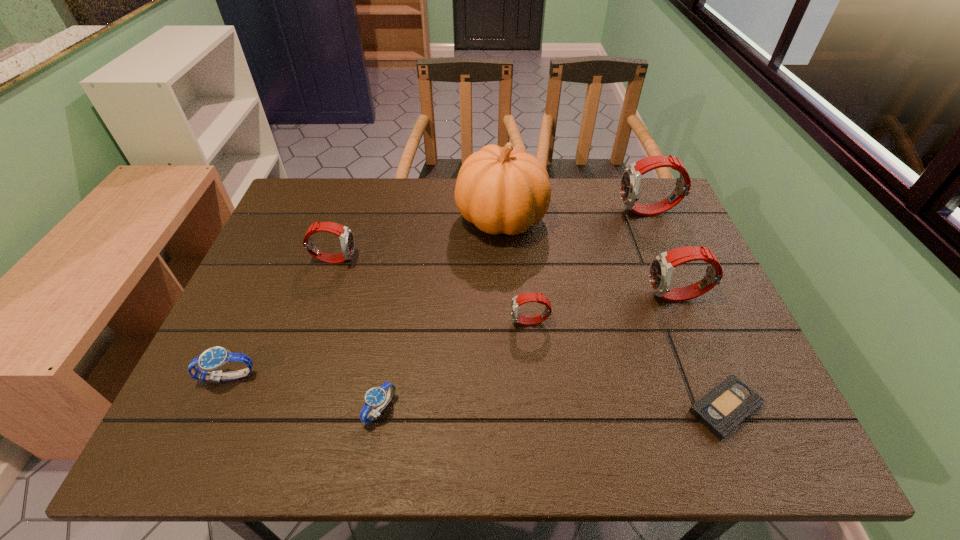
Locate an element on the screen. orange pumpkin is located at coordinates (501, 190).

Identify the location of pumpkin. (501, 190).

The width and height of the screenshot is (960, 540). Find the location of `the biggest red watch`. the biggest red watch is located at coordinates (631, 178).

Where is `the tallest watch`? The height and width of the screenshot is (540, 960). the tallest watch is located at coordinates (631, 178).

At what (x,y) coordinates should I click in order to perform the action: click on the third farthest watch. Please return your answer as a coordinate pair (x, y). This screenshot has width=960, height=540. Looking at the image, I should click on (662, 266).

Image resolution: width=960 pixels, height=540 pixels. Identify the location of the second biggest red watch. (662, 266).

I want to click on the fifth watch from right to left, so click(346, 236).

Find the location of a particular element. The width and height of the screenshot is (960, 540). the fifth shortest object is located at coordinates (346, 236).

I want to click on the second red watch from left to right, so click(518, 300).

Where is `the fifth tallest object`? The width and height of the screenshot is (960, 540). the fifth tallest object is located at coordinates coord(518,300).